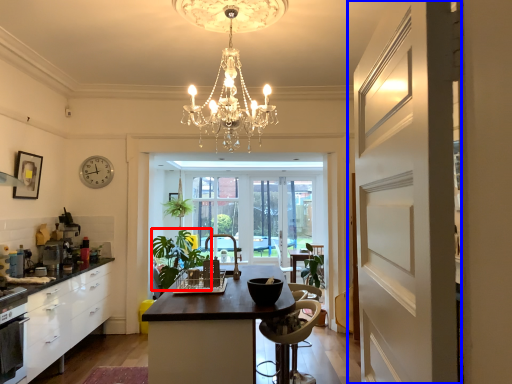
Question: Which object is closer to the camera taking this photo, plant (highlighted by a red box) or door (highlighted by a blue box)?

Choices:
 (A) plant
 (B) door

Answer: (B)